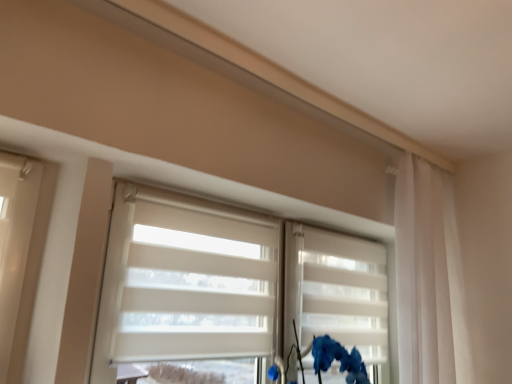
Question: Does matte blue flower at lower right lie behind white matte shutter at center?

Choices:
 (A) no
 (B) yes

Answer: (A)

Question: From a real-world perspective, is matte blue flower at lower right over white matte shutter at center?

Choices:
 (A) no
 (B) yes

Answer: (A)

Question: From the image's perspective, does matte blue flower at lower right appear lower than white matte shutter at center?

Choices:
 (A) yes
 (B) no

Answer: (A)

Question: Would you say matte blue flower at lower right contains white matte shutter at center?

Choices:
 (A) yes
 (B) no

Answer: (B)

Question: Is matte blue flower at lower right looking in the opposite direction of white matte shutter at center?

Choices:
 (A) yes
 (B) no

Answer: (A)

Question: From the image's perspective, does matte blue flower at lower right appear higher than white matte shutter at center?

Choices:
 (A) yes
 (B) no

Answer: (B)

Question: From the image's perspective, is white matte shutter at center under white sheer curtain at right?

Choices:
 (A) yes
 (B) no

Answer: (A)

Question: Can we say white matte shutter at center lies outside white sheer curtain at right?

Choices:
 (A) no
 (B) yes

Answer: (B)

Question: From a real-world perspective, is white matte shutter at center on top of white sheer curtain at right?

Choices:
 (A) no
 (B) yes

Answer: (A)

Question: Can you confirm if white matte shutter at center is shorter than white sheer curtain at right?

Choices:
 (A) yes
 (B) no

Answer: (A)

Question: Is white matte shutter at center bigger than white sheer curtain at right?

Choices:
 (A) yes
 (B) no

Answer: (B)

Question: From the image's perspective, is white matte shutter at center on top of white sheer curtain at right?

Choices:
 (A) yes
 (B) no

Answer: (B)

Question: From a real-world perspective, is white sheer curtain at right positioned over matte blue flower at lower right based on gravity?

Choices:
 (A) yes
 (B) no

Answer: (A)